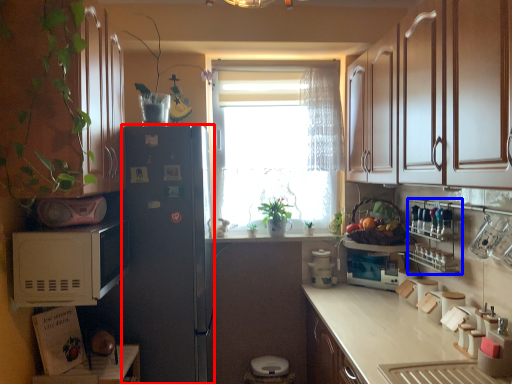
Question: Which point is closer to the camera, refrigerator (highlighted by a red box) or shelf (highlighted by a blue box)?

Choices:
 (A) refrigerator
 (B) shelf

Answer: (B)